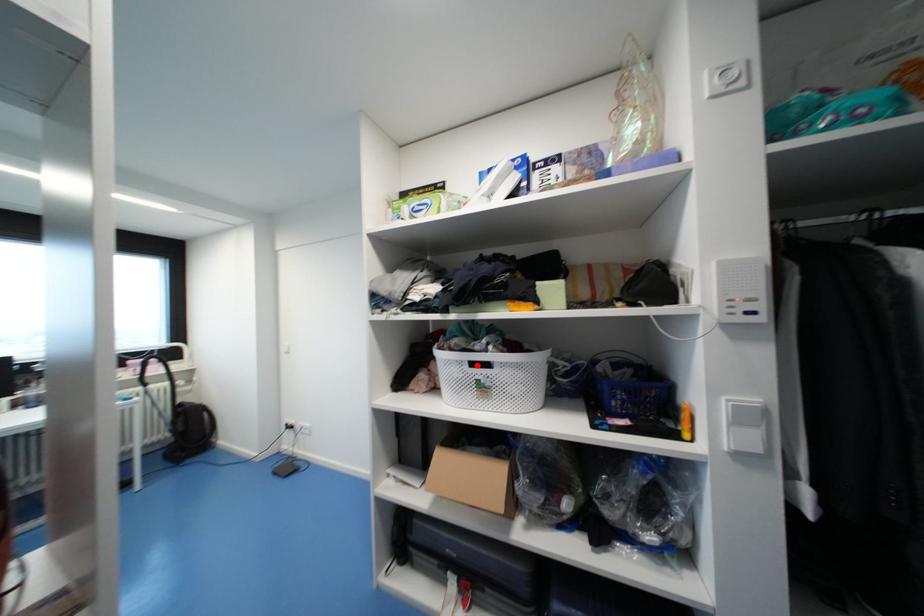
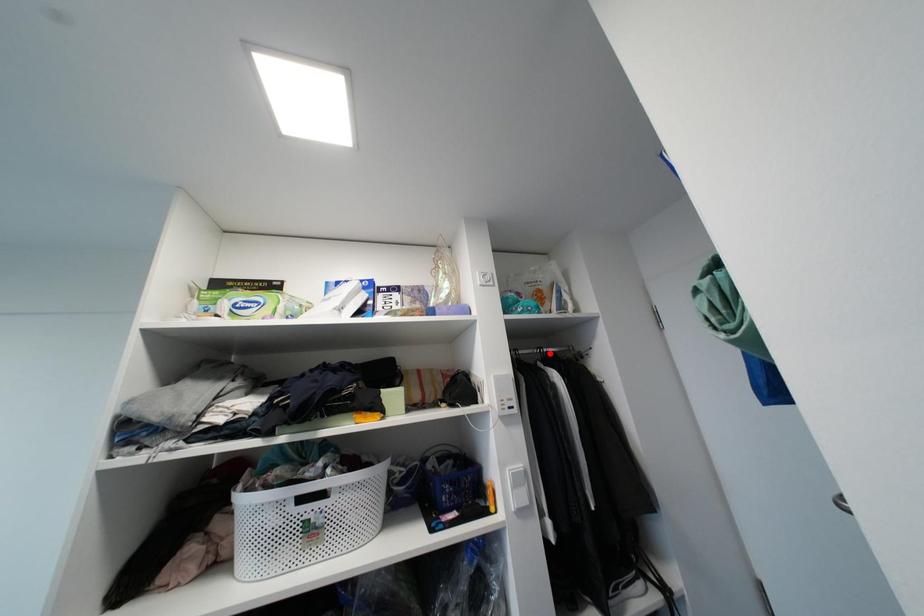
I am providing you with two images of the same scene from different viewpoints. A red point is marked on the first image and another point is marked on the second image. Is the marked point in image1 the same physical position as the marked point in image2?

No